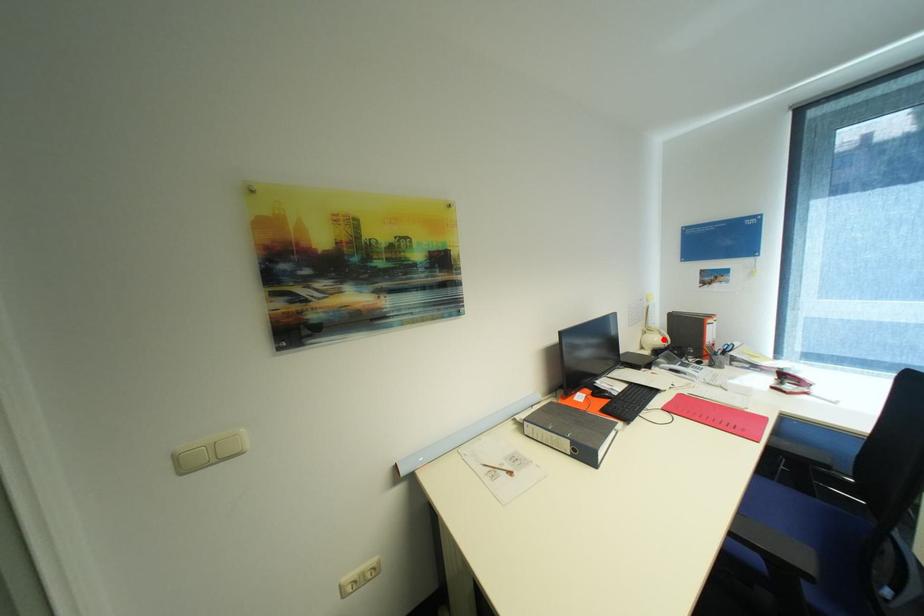
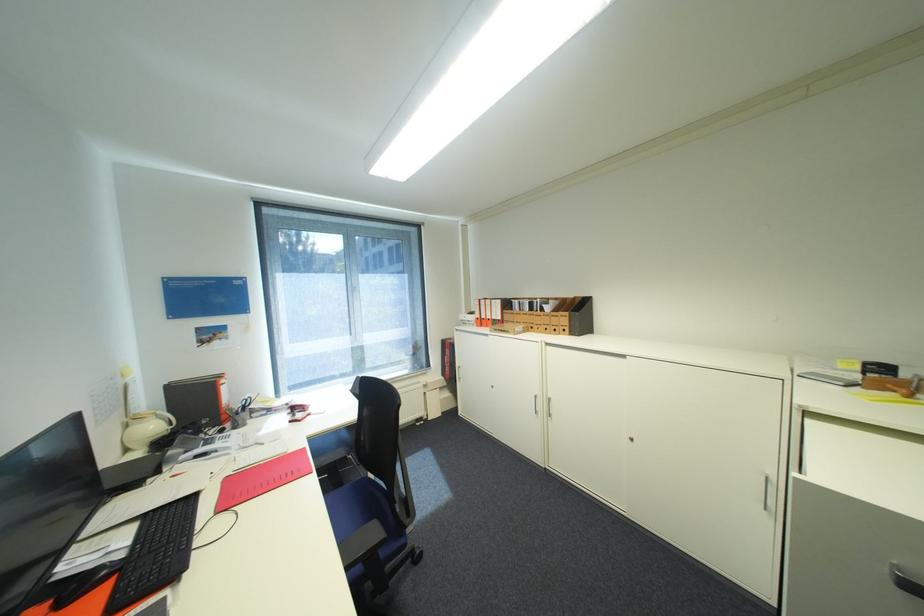
In the second image, find the point that corresponds to the highlighted location in the first image.

(161, 427)